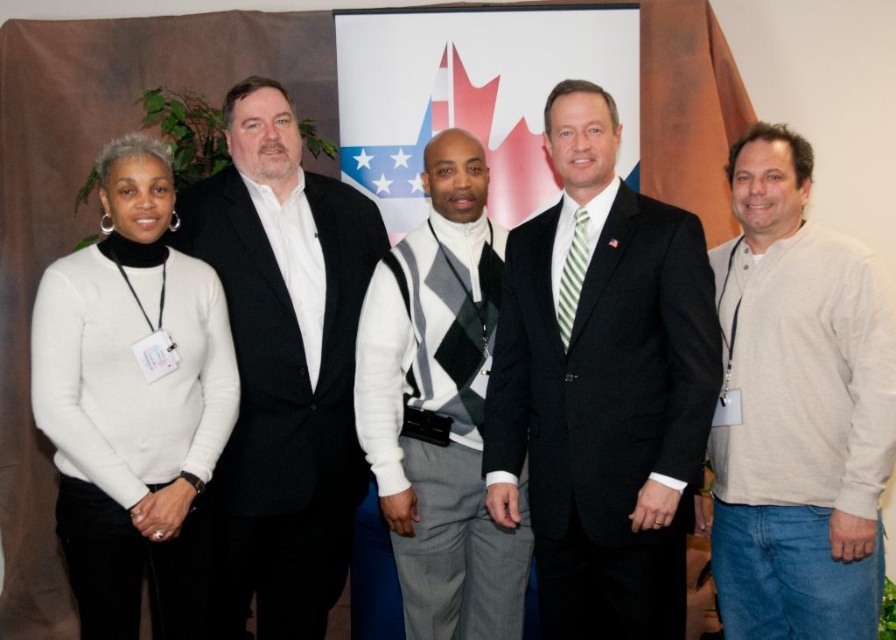
Is point (264, 566) farther from camera compared to point (481, 502)?

Yes, point (264, 566) is farther from viewer.

Where is `black wool suit at center`? The height and width of the screenshot is (640, 896). black wool suit at center is located at coordinates (283, 365).

Which of these two, dark suit at center or white argyle sweater vest at center, stands shorter?

dark suit at center is shorter.

Is point (595, 480) less distant than point (462, 323)?

Yes, it is.

Between point (549, 288) and point (448, 429), which one is positioned behind?

The point (448, 429) is behind.

At what (x,y) coordinates should I click in order to perform the action: click on dark suit at center. Please return your answer as a coordinate pair (x, y). Looking at the image, I should click on (602, 387).

Can you confirm if white sweater at left is positioned above white argyle sweater vest at center?

No, white sweater at left is not above white argyle sweater vest at center.

Can you confirm if white sweater at left is smaller than white argyle sweater vest at center?

Actually, white sweater at left might be larger than white argyle sweater vest at center.

What do you see at coordinates (134, 403) in the screenshot? Image resolution: width=896 pixels, height=640 pixels. I see `white sweater at left` at bounding box center [134, 403].

The image size is (896, 640). In order to click on white sweater at left in this screenshot , I will do `click(134, 403)`.